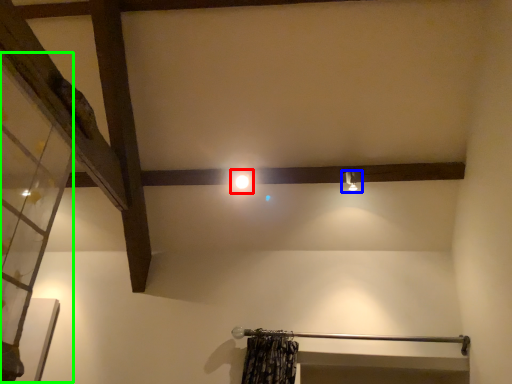
Question: Which object is positioned closest to light (highlighted by a red box)? Select from light fixture (highlighted by a blue box) and glass door (highlighted by a green box).

Choices:
 (A) light fixture
 (B) glass door

Answer: (A)